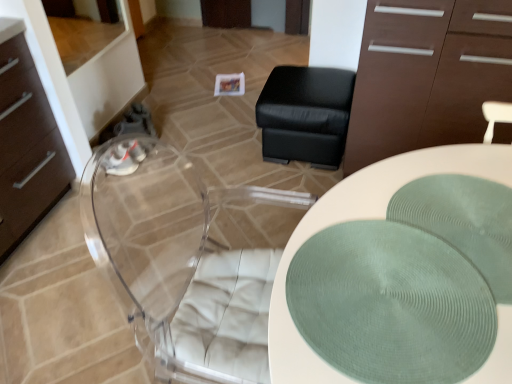
Question: From the image's perspective, is black leather ottoman at center over white textured placemat at center?

Choices:
 (A) no
 (B) yes

Answer: (B)

Question: Does black leather ottoman at center have a lesser width compared to white textured placemat at center?

Choices:
 (A) no
 (B) yes

Answer: (B)

Question: Is black leather ottoman at center smaller than white textured placemat at center?

Choices:
 (A) no
 (B) yes

Answer: (B)

Question: Can you confirm if black leather ottoman at center is shorter than white textured placemat at center?

Choices:
 (A) yes
 (B) no

Answer: (A)

Question: Is black leather ottoman at center with white textured placemat at center?

Choices:
 (A) no
 (B) yes

Answer: (A)

Question: Relative to green textured placemat at center, is white textured placemat at center in front or behind?

Choices:
 (A) front
 (B) behind

Answer: (A)

Question: From the image's perspective, relative to green textured placemat at center, is white textured placemat at center above or below?

Choices:
 (A) below
 (B) above

Answer: (A)

Question: Considering the positions of point (287, 254) and point (480, 201), is point (287, 254) closer or farther from the camera than point (480, 201)?

Choices:
 (A) closer
 (B) farther

Answer: (A)

Question: From a real-world perspective, relative to green textured placemat at center, is white textured placemat at center vertically above or below?

Choices:
 (A) below
 (B) above

Answer: (A)

Question: From the image's perspective, is brown matte cabinet at upper right located above or below green textured placemat at center?

Choices:
 (A) below
 (B) above

Answer: (B)

Question: Considering the positions of brown matte cabinet at upper right and green textured placemat at center in the image, is brown matte cabinet at upper right bigger or smaller than green textured placemat at center?

Choices:
 (A) small
 (B) big

Answer: (B)

Question: In terms of height, does brown matte cabinet at upper right look taller or shorter compared to green textured placemat at center?

Choices:
 (A) short
 (B) tall

Answer: (B)

Question: Do you think brown matte cabinet at upper right is within green textured placemat at center, or outside of it?

Choices:
 (A) inside
 (B) outside

Answer: (B)

Question: Is transparent acrylic swivel chair at center wider or thinner than green textured placemat at center?

Choices:
 (A) wide
 (B) thin

Answer: (A)

Question: From the image's perspective, relative to green textured placemat at center, is transparent acrylic swivel chair at center above or below?

Choices:
 (A) below
 (B) above

Answer: (B)